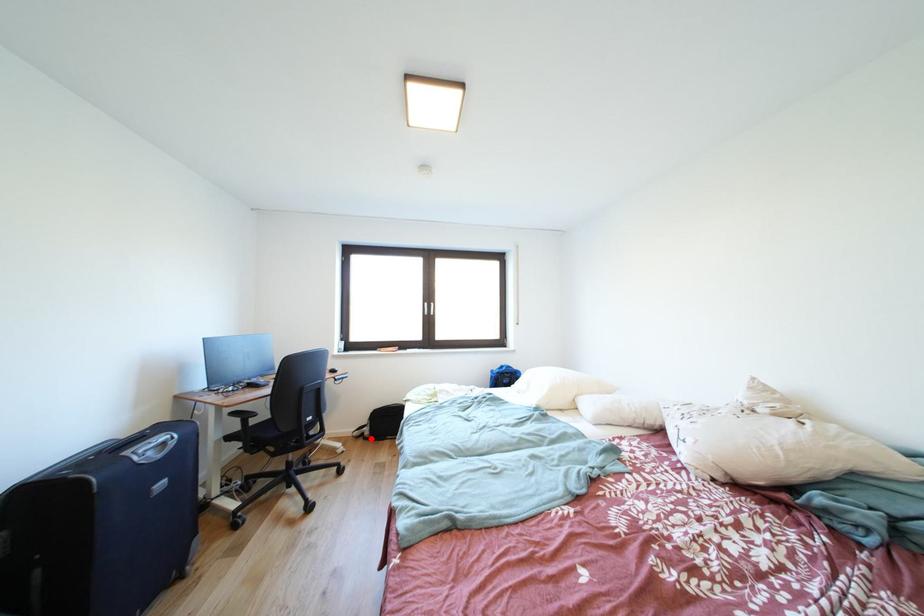
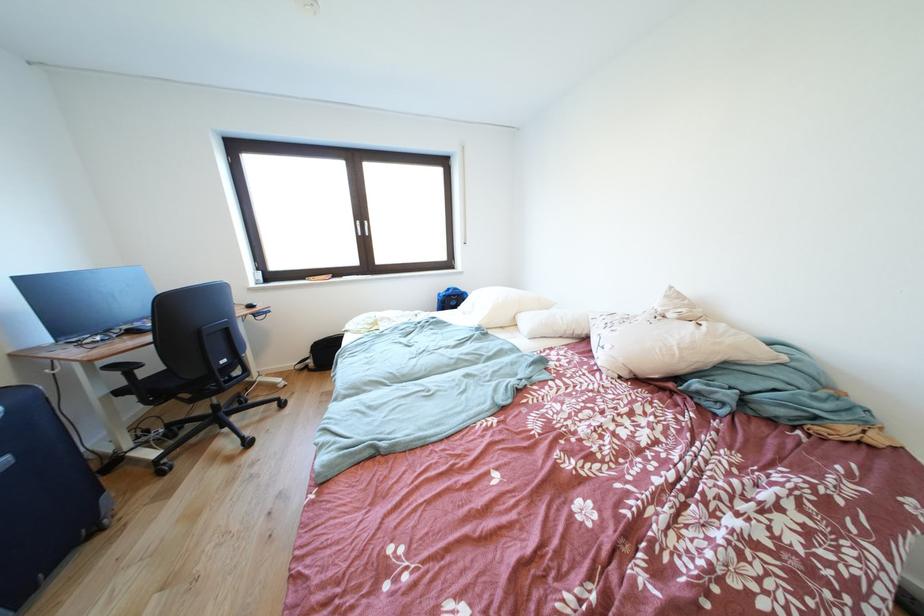
Question: I am providing you with two images of the same scene from different viewpoints. Image1 has a red point marked. In image2, the corresponding 3D location appears at what relative position? Reply with the corresponding letter.

Choices:
 (A) Closer
 (B) Farther

Answer: (B)